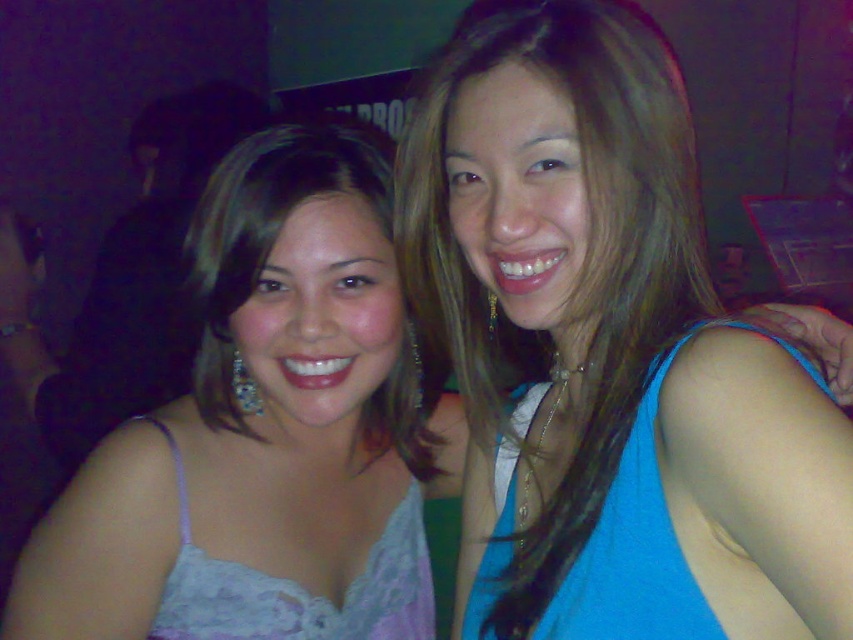
Question: Can you confirm if lace fabric dress at center is bigger than lace fabric dress at lower left?

Choices:
 (A) no
 (B) yes

Answer: (B)

Question: Does lace fabric dress at center appear over blue fabric dress at right?

Choices:
 (A) no
 (B) yes

Answer: (B)

Question: Does blue fabric top at upper right appear over lace fabric dress at lower left?

Choices:
 (A) no
 (B) yes

Answer: (B)

Question: Which object appears farthest from the camera in this image?

Choices:
 (A) blue fabric top at upper right
 (B) lace fabric dress at center
 (C) lace fabric dress at lower left
 (D) blue fabric dress at right

Answer: (C)

Question: Which object appears closest to the camera in this image?

Choices:
 (A) blue fabric dress at right
 (B) lace fabric dress at center
 (C) blue fabric top at upper right

Answer: (C)

Question: Which point is farther from the camera taking this photo?

Choices:
 (A) (393, 432)
 (B) (405, 634)
 (C) (583, 152)
 (D) (564, 637)

Answer: (A)